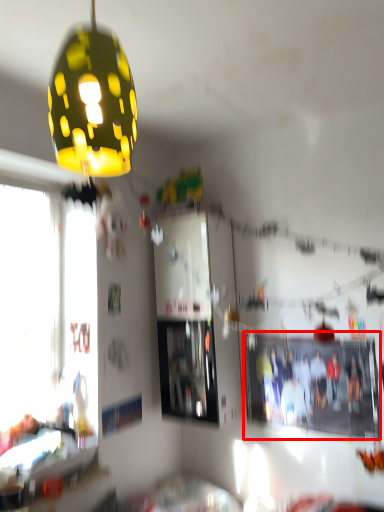
Question: From the image, what is the correct spatial relationship of bulletin board (annotated by the red box) in relation to lamp?

Choices:
 (A) right
 (B) left

Answer: (A)